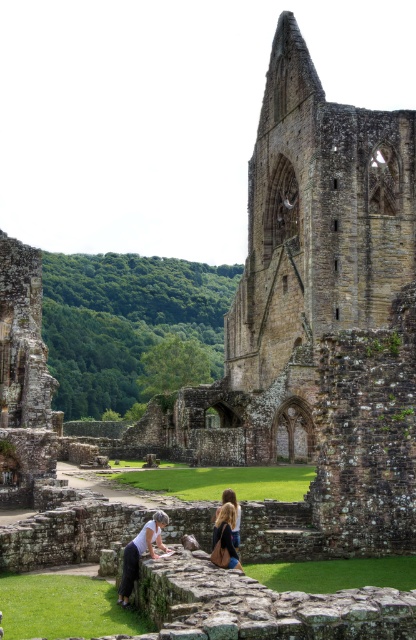
You are standing near the ruins of Tintern Abbey and want to take a photo of the green grass at lower center and the white cotton shirt at lower left. Which object occupies more horizontal space in the image?

The green grass at lower center occupies more horizontal space than the white cotton shirt at lower left because its width is larger.

You are a photographer planning to capture a landscape shot of Tintern Abbey ruins. You want to include both the green grass at lower center and the blonde hair at center in your frame. Which object should you focus on first if you want to ensure both are in focus?

The green grass at lower center is larger in size than the blonde hair at center, so focusing on the green grass at lower center first would help ensure both are in focus as it occupies more space in the frame.

You are standing at the ruins of Tintern Abbey and want to take a photo of both the point at coordinates point (386, 570) and point (230, 520). Which point should you position yourself closer to in order to capture both in the same frame?

You should position yourself closer to point (230, 520) because point (386, 570) is behind it, allowing both points to be in the same frame when you are near the front point.